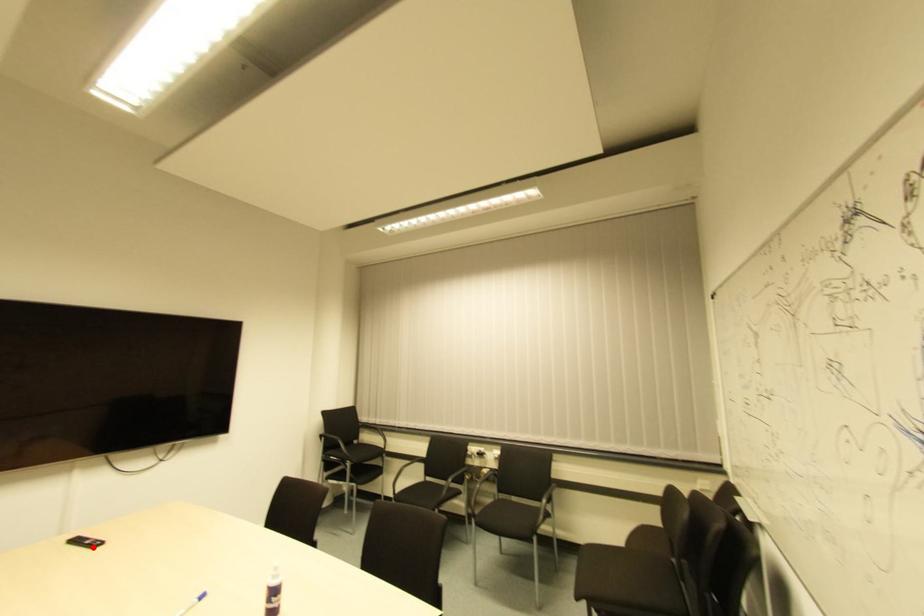
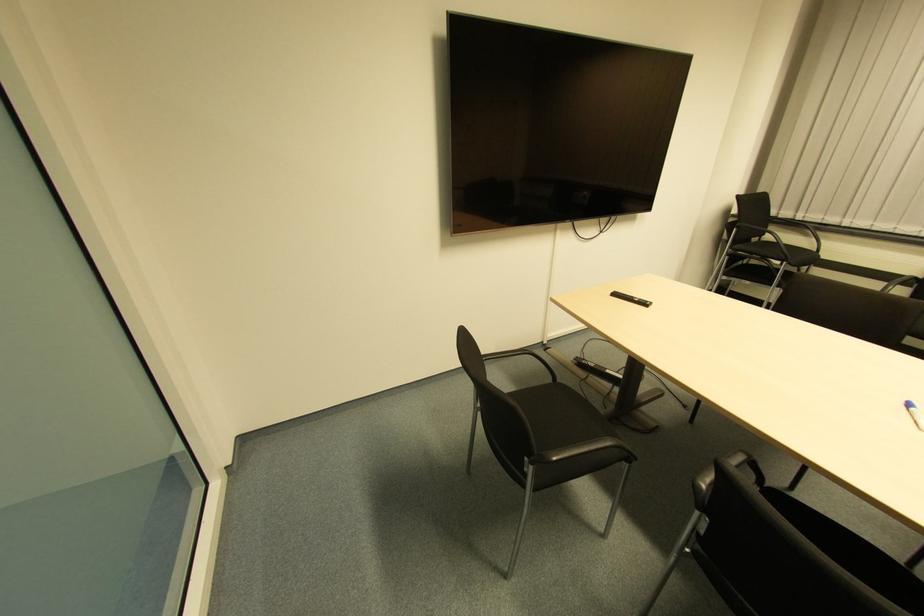
Locate, in the second image, the point that corresponds to the highlighted location in the first image.

(641, 306)